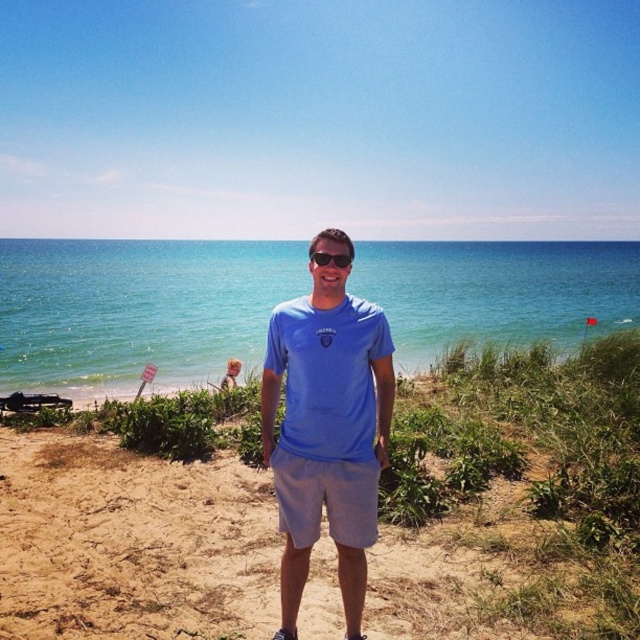
Which is below, light brown sand at center or sunglasses at center?

Positioned lower is light brown sand at center.

Who is shorter, light brown sand at center or sunglasses at center?

With less height is sunglasses at center.

Where is `light brown sand at center`? Image resolution: width=640 pixels, height=640 pixels. light brown sand at center is located at coordinates (513, 499).

The image size is (640, 640). What do you see at coordinates (513, 499) in the screenshot?
I see `light brown sand at center` at bounding box center [513, 499].

Who is shorter, light brown sand at center or blue fabric shirt at center?

Standing shorter between the two is light brown sand at center.

Who is more distant from viewer, [104,474] or [269,378]?

The point [104,474] is behind.

You are a GUI agent. You are given a task and a screenshot of the screen. Output one action in this format:
    pyautogui.click(x=<x>, y=<y>)
    Task: Click on the light brown sand at center
    Image resolution: width=640 pixels, height=640 pixels.
    Given the screenshot: What is the action you would take?
    pyautogui.click(x=513, y=499)

Can you confirm if blue fabric shirt at center is shorter than sunglasses at center?

No, blue fabric shirt at center is not shorter than sunglasses at center.

Which is behind, point (272, 419) or point (340, 256)?

The point (272, 419) is more distant.

At what (x,y) coordinates should I click in order to perform the action: click on blue fabric shirt at center. Please return your answer as a coordinate pair (x, y). Looking at the image, I should click on point(326,428).